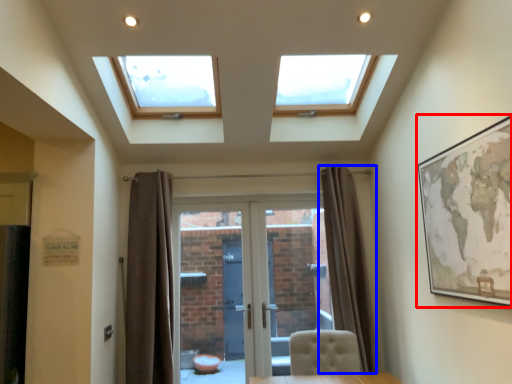
Question: Which object is further to the camera taking this photo, picture frame (highlighted by a red box) or curtain (highlighted by a blue box)?

Choices:
 (A) picture frame
 (B) curtain

Answer: (B)